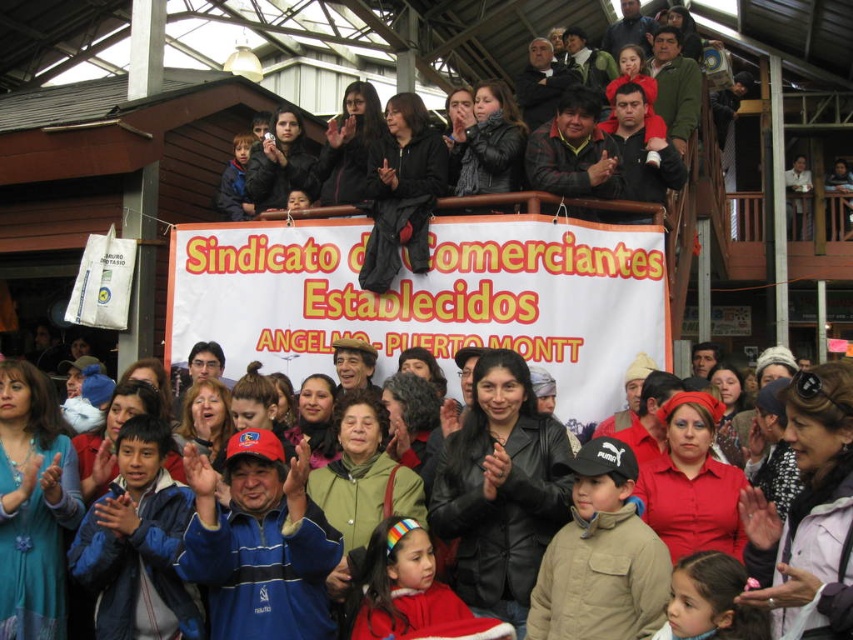
Between tan fleece jacket at center and blue fleece jacket at center, which one appears on the right side from the viewer's perspective?

From the viewer's perspective, tan fleece jacket at center appears more on the right side.

Does tan fleece jacket at center lie in front of blue fleece jacket at center?

Yes, it is in front of blue fleece jacket at center.

Locate an element on the screen. The image size is (853, 640). tan fleece jacket at center is located at coordinates (601, 556).

Who is taller, matte black jacket at center or red fleece jacket at lower center?

matte black jacket at center

Is matte black jacket at center to the right of red fleece jacket at lower center from the viewer's perspective?

Correct, you'll find matte black jacket at center to the right of red fleece jacket at lower center.

The image size is (853, 640). In order to click on matte black jacket at center in this screenshot , I will do `click(807, 508)`.

Between matte black jacket at center and blue fleece jacket at center, which one has more height?

Standing taller between the two is matte black jacket at center.

Is point (825, 536) positioned after point (86, 536)?

No, (825, 536) is in front of (86, 536).

Is point (706, 428) more distant than point (178, 513)?

No, it is in front of (178, 513).

Locate an element on the screen. This screenshot has height=640, width=853. matte black jacket at center is located at coordinates (807, 508).